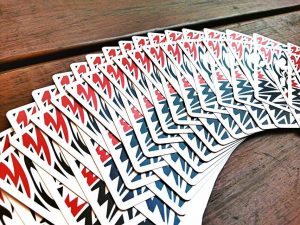
Find the location of a particular element. The image size is (300, 225). scratch on wood is located at coordinates (266, 153).